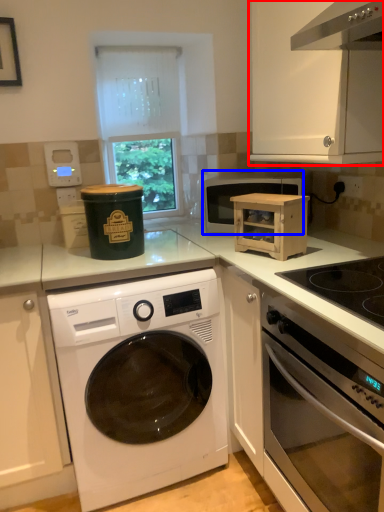
Question: Which object appears closest to the camera in this image, cabinetry (highlighted by a red box) or microwave oven (highlighted by a blue box)?

Choices:
 (A) cabinetry
 (B) microwave oven

Answer: (A)